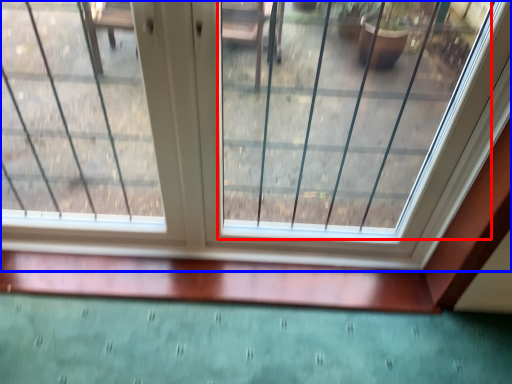
Question: Among these objects, which one is farthest to the camera, glass window (highlighted by a red box) or window (highlighted by a blue box)?

Choices:
 (A) glass window
 (B) window

Answer: (B)